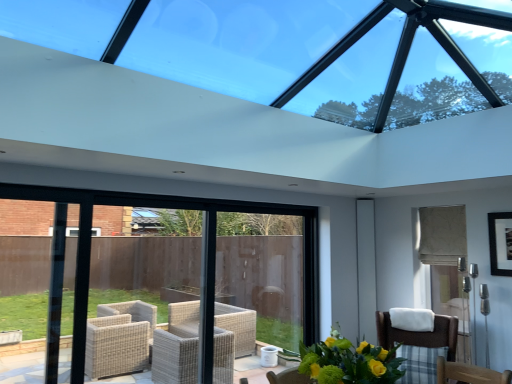
Question: Can you confirm if black matte picture frame at upper right is wider than brown woven chair at lower right?

Choices:
 (A) no
 (B) yes

Answer: (A)

Question: From the image's perspective, does black matte picture frame at upper right appear higher than brown woven chair at lower right?

Choices:
 (A) no
 (B) yes

Answer: (B)

Question: Is brown woven chair at lower right at the back of black matte picture frame at upper right?

Choices:
 (A) no
 (B) yes

Answer: (A)

Question: Considering the relative sizes of black matte picture frame at upper right and brown woven chair at lower right in the image provided, is black matte picture frame at upper right smaller than brown woven chair at lower right?

Choices:
 (A) no
 (B) yes

Answer: (B)

Question: From a real-world perspective, does black matte picture frame at upper right sit lower than brown woven chair at lower right?

Choices:
 (A) yes
 (B) no

Answer: (B)

Question: Would you say black matte picture frame at upper right is outside brown woven chair at lower right?

Choices:
 (A) yes
 (B) no

Answer: (A)

Question: From a real-world perspective, is yellow-green bouquet at lower center beneath black matte picture frame at upper right?

Choices:
 (A) no
 (B) yes

Answer: (B)

Question: Is yellow-green bouquet at lower center far from black matte picture frame at upper right?

Choices:
 (A) yes
 (B) no

Answer: (A)

Question: Would you say yellow-green bouquet at lower center is outside black matte picture frame at upper right?

Choices:
 (A) yes
 (B) no

Answer: (A)

Question: From the image's perspective, is yellow-green bouquet at lower center beneath black matte picture frame at upper right?

Choices:
 (A) yes
 (B) no

Answer: (A)

Question: Is yellow-green bouquet at lower center aimed at black matte picture frame at upper right?

Choices:
 (A) no
 (B) yes

Answer: (A)

Question: Does yellow-green bouquet at lower center have a greater height compared to black matte picture frame at upper right?

Choices:
 (A) no
 (B) yes

Answer: (A)

Question: From the image's perspective, is white glossy screen door at right below transparent glass window at upper center?

Choices:
 (A) no
 (B) yes

Answer: (B)